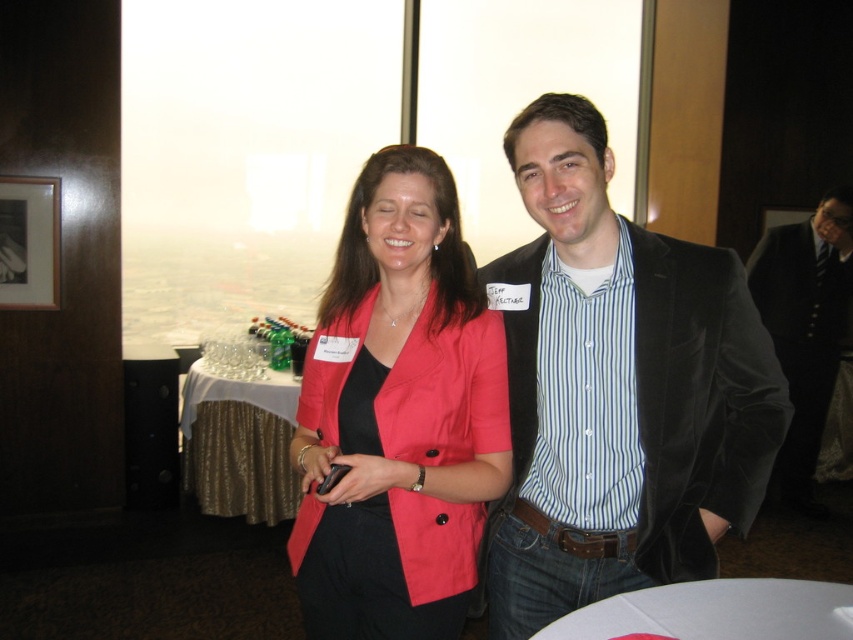
Question: Which point is closer to the camera taking this photo?

Choices:
 (A) (628, 612)
 (B) (511, 541)

Answer: (A)

Question: Does matte red blazer at center have a lesser width compared to white glossy table at lower center?

Choices:
 (A) no
 (B) yes

Answer: (B)

Question: Which object is closer to the camera taking this photo?

Choices:
 (A) black velvet suit at right
 (B) velvet black blazer at center
 (C) matte red blazer at center

Answer: (C)

Question: Is matte red blazer at center smaller than gold sequined tablecloth at center?

Choices:
 (A) yes
 (B) no

Answer: (A)

Question: Can you confirm if matte red blazer at center is thinner than white glossy table at lower center?

Choices:
 (A) no
 (B) yes

Answer: (B)

Question: Which object is the farthest from the velvet black blazer at center?

Choices:
 (A) white glossy table at lower center
 (B) gold sequined tablecloth at center
 (C) matte red blazer at center

Answer: (B)